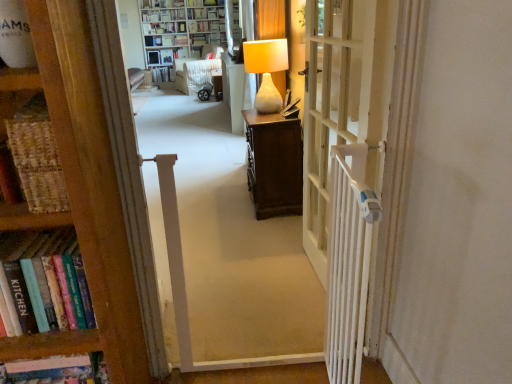
Question: In the image, is white wooden door at center positioned in front of or behind matte white shelf at upper center?

Choices:
 (A) front
 (B) behind

Answer: (A)

Question: Is white wooden door at center situated inside matte white shelf at upper center or outside?

Choices:
 (A) inside
 (B) outside

Answer: (B)

Question: Estimate the real-world distances between objects in this image. Which object is farther from the wooden bookcase at left, acting as the 1th bookcase starting from the front?

Choices:
 (A) matte white lamp at center, which ranks as the second furniture in back-to-front order
 (B) white plastic radiator at right
 (C) white wooden gate at center
 (D) white glossy bookcase at upper center, the second bookcase positioned from the bottom
 (E) matte white shelf at upper center

Answer: (E)

Question: Considering the real-world distances, which object is farthest from the white glossy bookcase at upper center, the second bookcase positioned from the bottom?

Choices:
 (A) matte white shelf at upper center
 (B) hardcover book at upper center, arranged as the third book when ordered from the bottom
 (C) white wooden door at center
 (D) matte white lamp at center, which is the first furniture in right-to-left order
 (E) matte white lamp at center

Answer: (C)